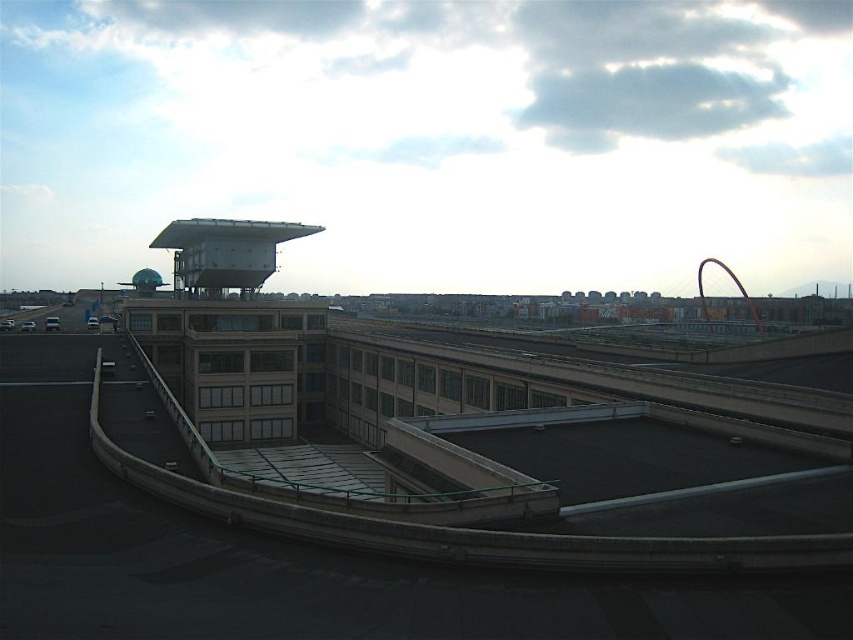
Consider the image. You are an architect planning to install a new antenna on the roof. You have two options for placement locations based on the existing water towers. The first location is near the metallic gray water tower at upper center, and the second is near the metallic green water tower at upper left. Which location would allow for a larger antenna installation area?

The metallic green water tower at upper left occupies more space, so the location near the metallic gray water tower at upper center allows for a larger antenna installation area since it takes up less space.

You are standing at the base of the building and want to take a photo of the metallic gray water tower at upper center. If your camera has a maximum zoom range of 50 meters, will you be able to capture the tower clearly?

The distance between the metallic gray water tower at upper center and the camera is 80.68 meters, which exceeds the camera maximum zoom range of 50 meters. Therefore, you will not be able to capture the tower clearly.